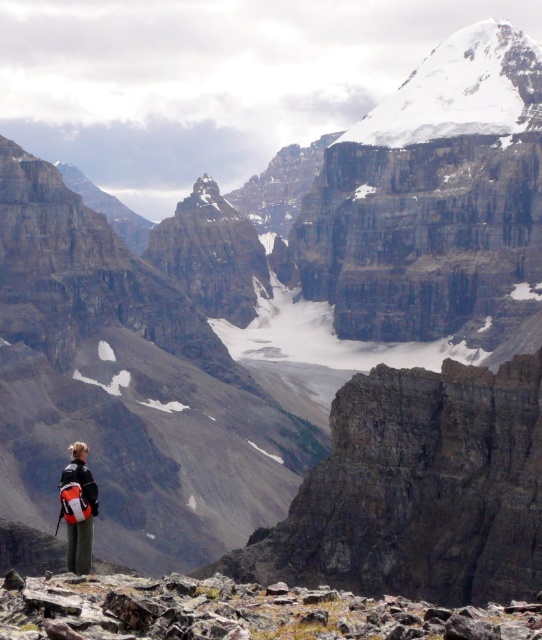
You are a hiker standing at the point labeled point (159,627) and want to reach the point labeled point (480,49). Given the rugged terrain described in the scene, which direction should you move to get closer to your destination?

Since point (159,627) is closer to the viewer than point (480,49), you should move away from the camera to reach your destination.